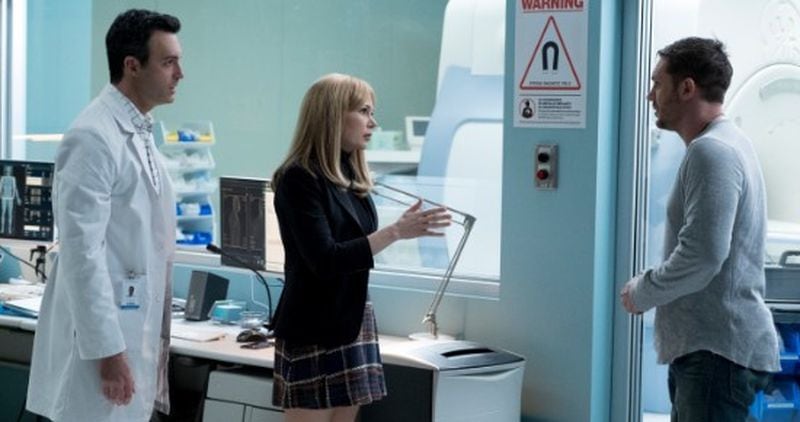
The width and height of the screenshot is (800, 422). In order to click on wall in this screenshot , I will do `click(544, 244)`.